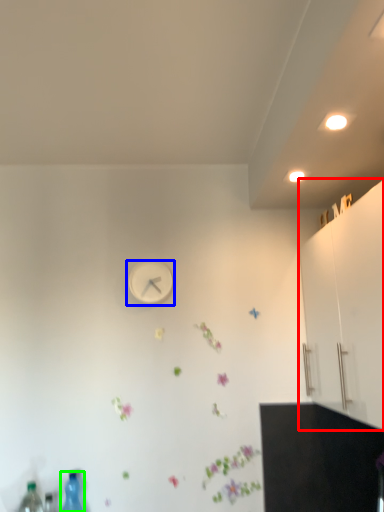
Question: Estimate the real-world distances between objects in this image. Which object is farther from dresser (highlighted by a red box), wall clock (highlighted by a blue box) or bottle (highlighted by a green box)?

Choices:
 (A) wall clock
 (B) bottle

Answer: (B)